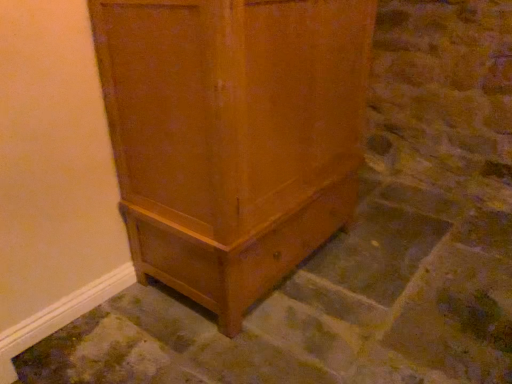
This screenshot has width=512, height=384. Find the location of `free location in front of matte wood cabinet at center`. free location in front of matte wood cabinet at center is located at coordinates (271, 344).